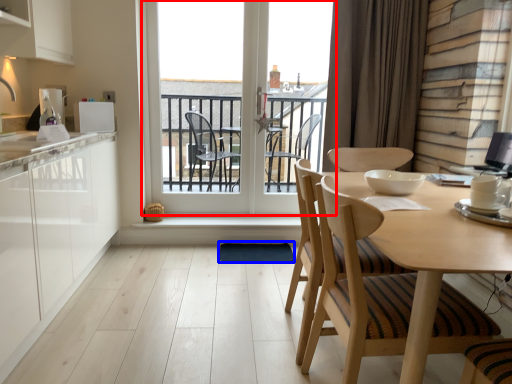
Question: Which object appears farthest to the camera in this image, window (highlighted by a red box) or wide (highlighted by a blue box)?

Choices:
 (A) window
 (B) wide

Answer: (A)